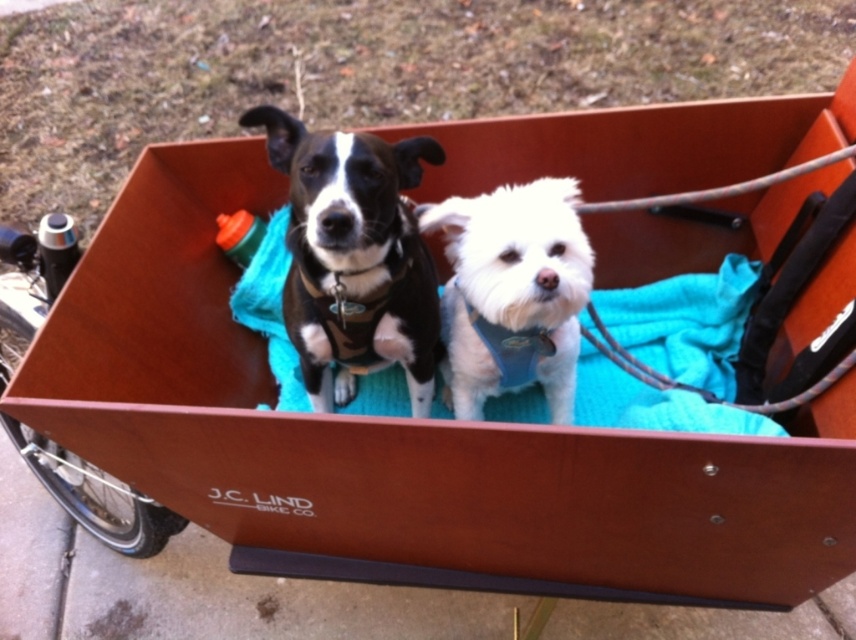
Question: Is black matte harness at center above white fluffy dog at center?

Choices:
 (A) no
 (B) yes

Answer: (B)

Question: Does black matte harness at center have a smaller size compared to white fluffy dog at center?

Choices:
 (A) no
 (B) yes

Answer: (A)

Question: Can you confirm if black matte harness at center is positioned to the right of white fluffy dog at center?

Choices:
 (A) yes
 (B) no

Answer: (B)

Question: Which of the following is the closest to the observer?

Choices:
 (A) (295, 157)
 (B) (538, 250)

Answer: (B)